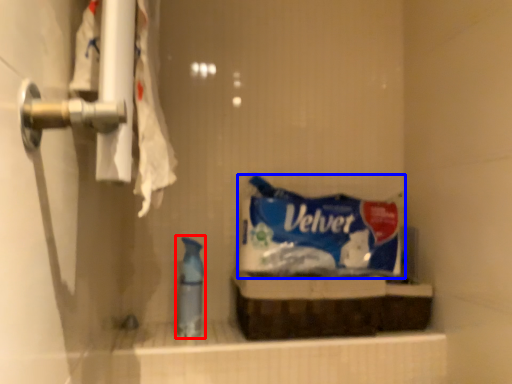
Question: Which point is closer to the camera, cleaning product (highlighted by a red box) or snack (highlighted by a blue box)?

Choices:
 (A) cleaning product
 (B) snack

Answer: (A)